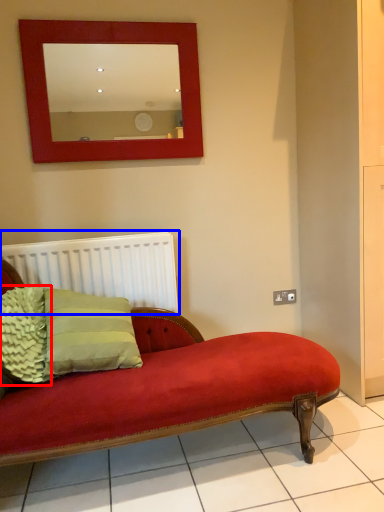
Question: Which of the following is the farthest to the observer, pillow (highlighted by a red box) or radiator (highlighted by a blue box)?

Choices:
 (A) pillow
 (B) radiator

Answer: (B)